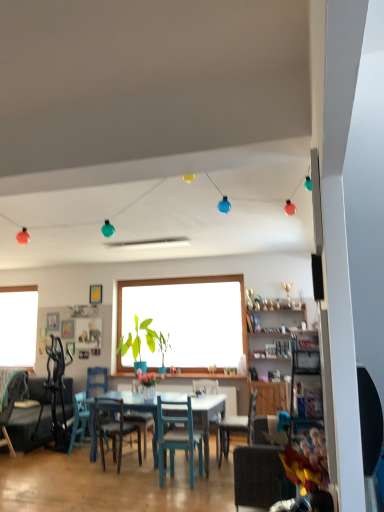
Question: Should I look upward or downward to see black matte speaker at right?

Choices:
 (A) up
 (B) down

Answer: (B)

Question: Is wooden picture frame at left, which is counted as the second picture frame, starting from the bottom, smaller than wooden picture frame at center, acting as the 1th picture frame starting from the bottom?

Choices:
 (A) no
 (B) yes

Answer: (B)

Question: From the image's perspective, would you say wooden picture frame at left, which is the third picture frame from right to left, is shown under wooden picture frame at center, acting as the 1th picture frame starting from the bottom?

Choices:
 (A) yes
 (B) no

Answer: (B)

Question: Can you confirm if wooden picture frame at left, which is the third picture frame from right to left, is positioned to the right of wooden picture frame at center, acting as the 1th picture frame starting from the bottom?

Choices:
 (A) yes
 (B) no

Answer: (B)

Question: Is wooden picture frame at left, acting as the first picture frame starting from the left, wider than wooden picture frame at center, marked as the third picture frame in a top-to-bottom arrangement?

Choices:
 (A) yes
 (B) no

Answer: (B)

Question: Does wooden picture frame at left, which is counted as the second picture frame, starting from the bottom, have a greater height compared to wooden picture frame at center, marked as the third picture frame in a top-to-bottom arrangement?

Choices:
 (A) yes
 (B) no

Answer: (B)

Question: Is wooden picture frame at left, acting as the first picture frame starting from the left, positioned far away from wooden picture frame at center, the second picture frame viewed from the right?

Choices:
 (A) no
 (B) yes

Answer: (A)

Question: From the image's perspective, is green matte plant at center beneath teal fabric chair at lower left, which ranks as the 1th chair in left-to-right order?

Choices:
 (A) yes
 (B) no

Answer: (B)

Question: Considering the relative sizes of green matte plant at center and teal fabric chair at lower left, which ranks as the 1th chair in left-to-right order, in the image provided, is green matte plant at center shorter than teal fabric chair at lower left, which ranks as the 1th chair in left-to-right order,?

Choices:
 (A) no
 (B) yes

Answer: (B)

Question: Is green matte plant at center in front of teal fabric chair at lower left, which ranks as the 1th chair in left-to-right order?

Choices:
 (A) no
 (B) yes

Answer: (A)

Question: Can you confirm if green matte plant at center is bigger than teal fabric chair at lower left, which ranks as the 1th chair in left-to-right order?

Choices:
 (A) yes
 (B) no

Answer: (B)

Question: From a real-world perspective, is green matte plant at center below teal fabric chair at lower left, which ranks as the 1th chair in left-to-right order?

Choices:
 (A) no
 (B) yes

Answer: (A)

Question: Does green matte plant at center appear on the right side of teal fabric chair at lower left, marked as the 6th chair in a right-to-left arrangement?

Choices:
 (A) no
 (B) yes

Answer: (B)

Question: From a real-world perspective, is dark gray fabric couch at lower left on top of green matte plant at center?

Choices:
 (A) no
 (B) yes

Answer: (A)